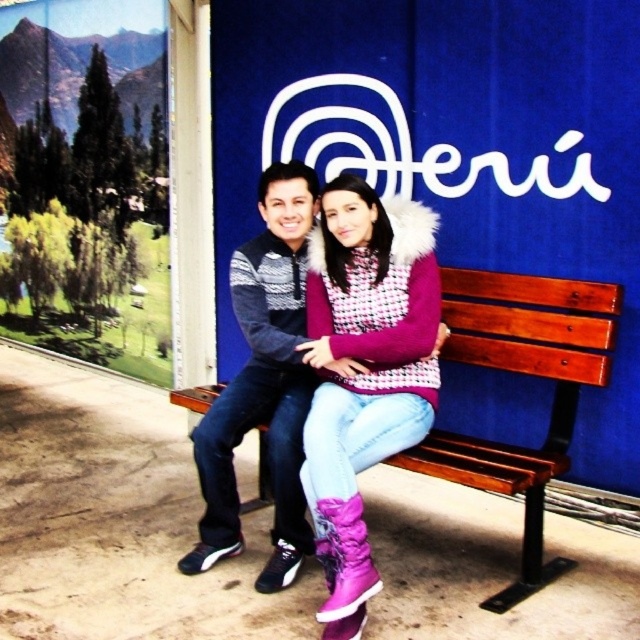
In the scene shown: You are a photographer who needs to ensure that both the blue fabric peru sign at center and the purple suede boots at center are clearly visible in your photo. Based on their positions, which one should you focus on first to ensure it doesn

The blue fabric peru sign at center is above the purple suede boots at center, so you should focus on the purple suede boots at center first since it is closer to the camera and easier to capture clearly before adjusting focus upward to the sign.

You are standing in front of the bench and want to take a photo of the purple suede boots at center and the dark gray knit sweater at center. Which object will appear larger in the photo?

The purple suede boots at center will appear larger in the photo because it is closer to the viewer than the dark gray knit sweater at center.

You are standing in front of the image and want to locate the purple suede boots at center. According to the coordinates given, where would you find them?

The purple suede boots at center are located at the 2D coordinates point (364, 369).